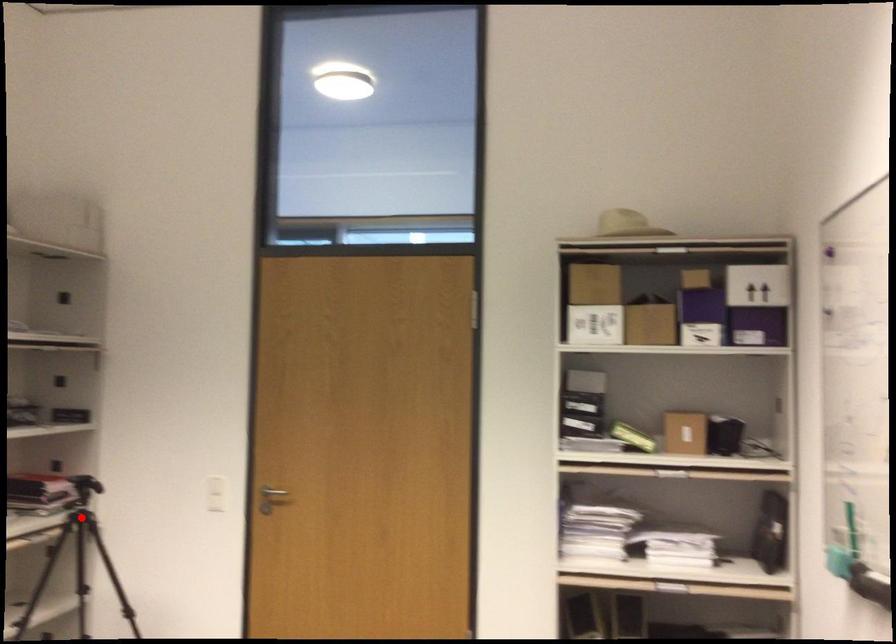
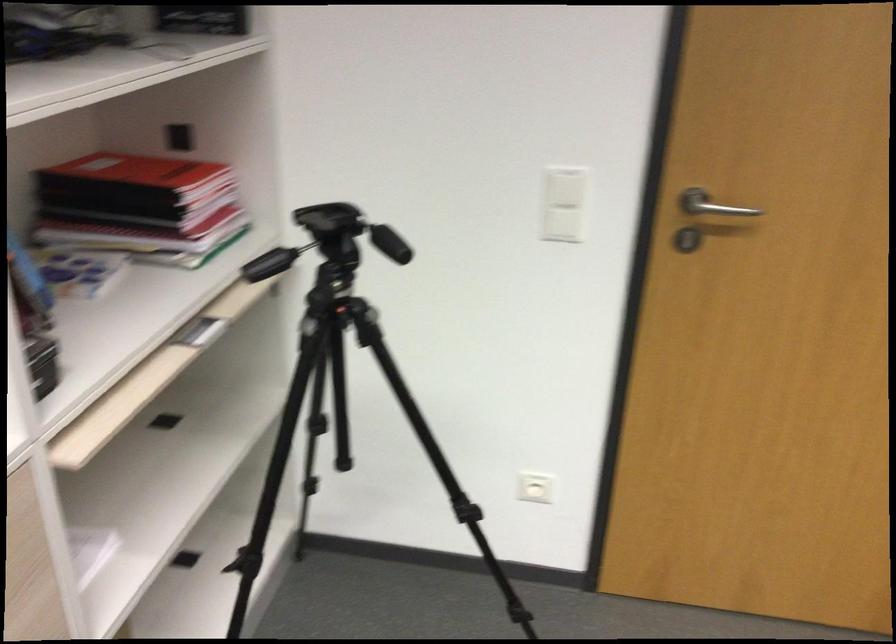
Question: I am providing you with two images of the same scene from different viewpoints. In image1, a red point is highlighted. Considering the same 3D point in image2, which of the following is correct?

Choices:
 (A) It is closer
 (B) It is farther

Answer: (A)